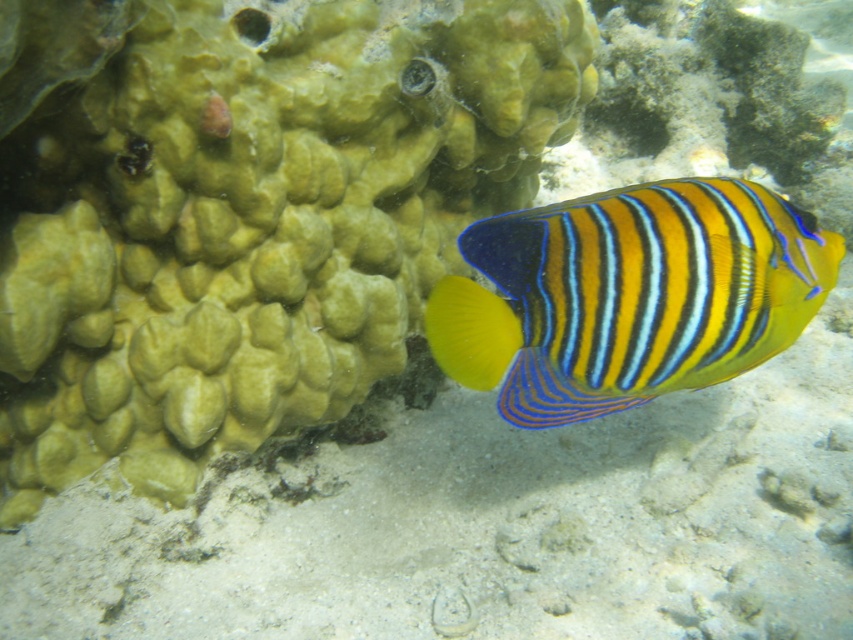
Question: Is green textured coral at center bigger than yellow striped fish at center?

Choices:
 (A) no
 (B) yes

Answer: (B)

Question: Is green textured coral at center further to camera compared to yellow striped fish at center?

Choices:
 (A) no
 (B) yes

Answer: (B)

Question: Which point appears farthest from the camera in this image?

Choices:
 (A) (286, 100)
 (B) (595, 339)

Answer: (A)

Question: Observing the image, what is the correct spatial positioning of green textured coral at center in reference to yellow striped fish at center?

Choices:
 (A) left
 (B) right

Answer: (A)

Question: Which point is farther from the camera taking this photo?

Choices:
 (A) (601, 401)
 (B) (468, 113)

Answer: (B)